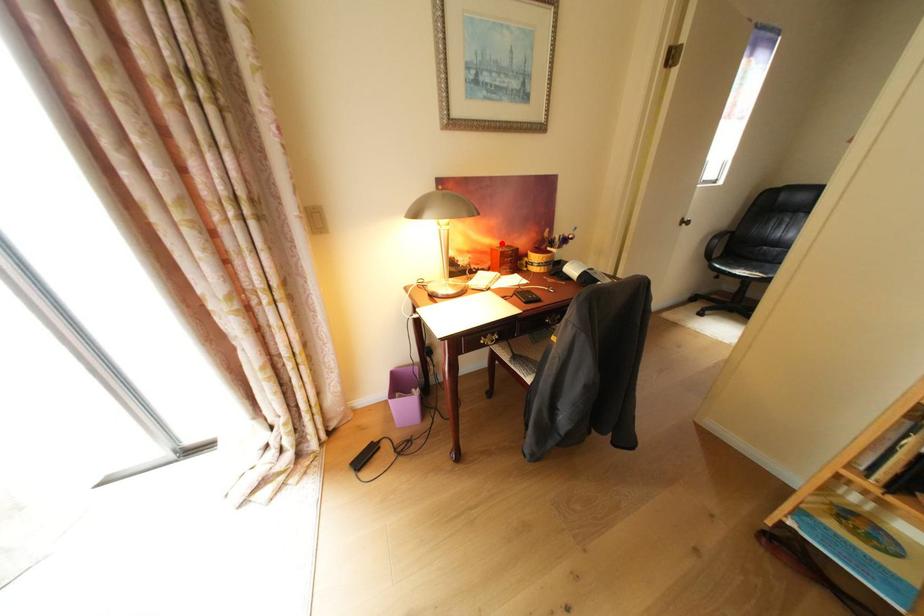
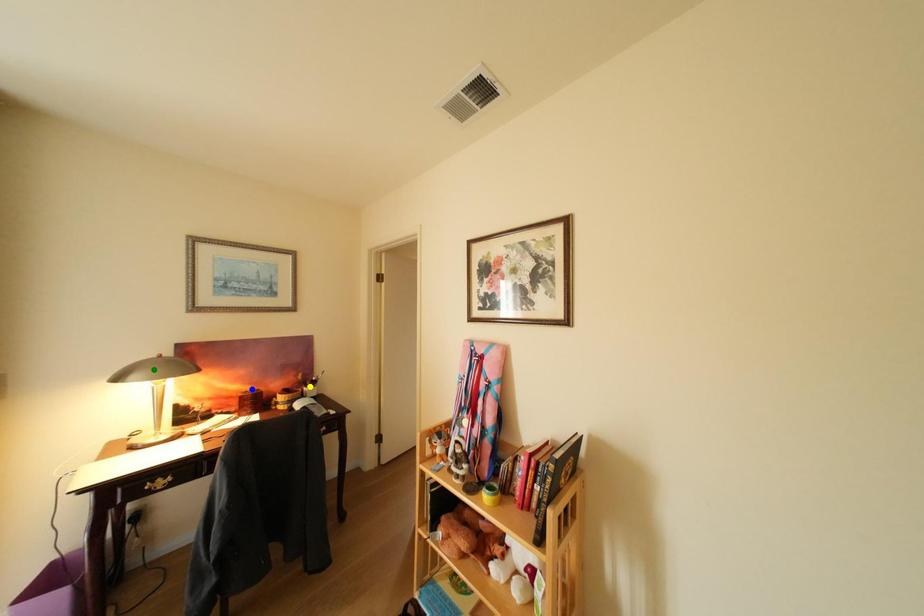
Question: I am providing you with two images of the same scene from different viewpoints. A red point is marked on the first image. You are given multiple points on the second image. Which point in image 2 represents the same 3d spot as the red point in image 1?

Choices:
 (A) blue point
 (B) yellow point
 (C) green point

Answer: (A)